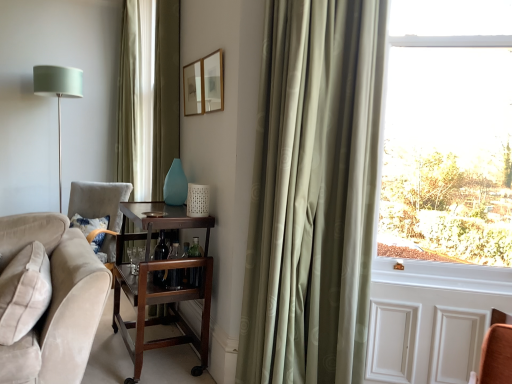
Question: Is teal glass vase at center inside or outside of mahogany wood bar cart at center?

Choices:
 (A) inside
 (B) outside

Answer: (B)

Question: Would you say teal glass vase at center is to the left or to the right of mahogany wood bar cart at center in the picture?

Choices:
 (A) right
 (B) left

Answer: (A)

Question: Estimate the real-world distances between objects in this image. Which object is farther from the mahogany wood bar cart at center?

Choices:
 (A) matte green shade at left
 (B) satin green curtain at right
 (C) wooden picture frame at upper center, which is the first picture frame from back to front
 (D) transparent glass window at right
 (E) velvet blue pillow at lower left

Answer: (A)

Question: Which object is the closest to the mahogany wood bar cart at center?

Choices:
 (A) wooden picture frame at upper center, which is the first picture frame from back to front
 (B) transparent glass window at right
 (C) teal glass vase at center
 (D) matte wooden picture frame at upper center, the second picture frame viewed from the left
 (E) velvet blue pillow at lower left

Answer: (C)